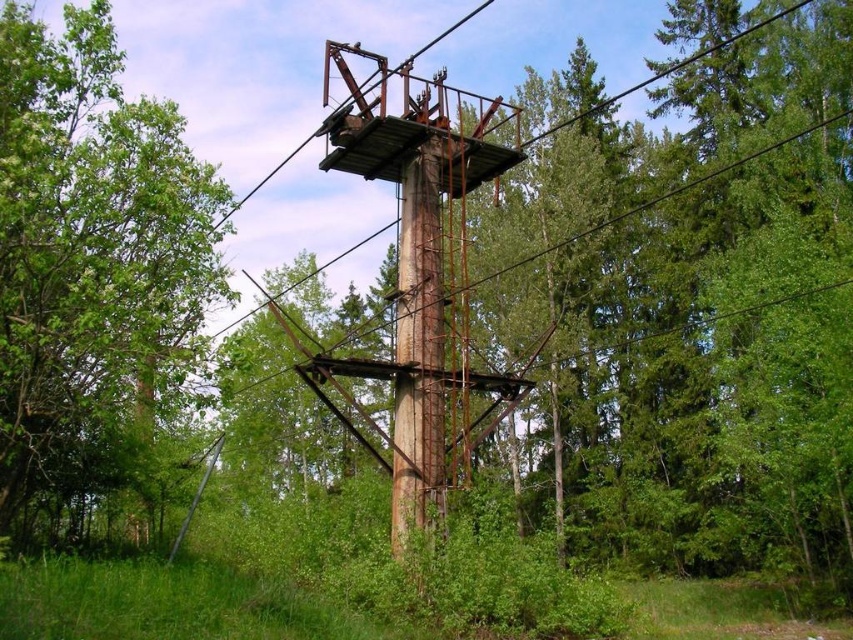
You are a hiker who wants to take a photo of the rusty metal pole at center with the green leafy tree at left in the background. Can you position yourself so that the tree is entirely behind the pole in the photo?

The green leafy tree at left might be wider than the rusty metal pole at center, so there is a possibility that parts of the tree could extend beyond the pole in the photo, making it difficult to have the entire tree completely behind the pole.

You are a hiker who just arrived at the scene. You see the green leafy tree at left and the rusty metal tower at center. Which one appears taller from your perspective?

The rusty metal tower at center is taller than the green leafy tree at left.